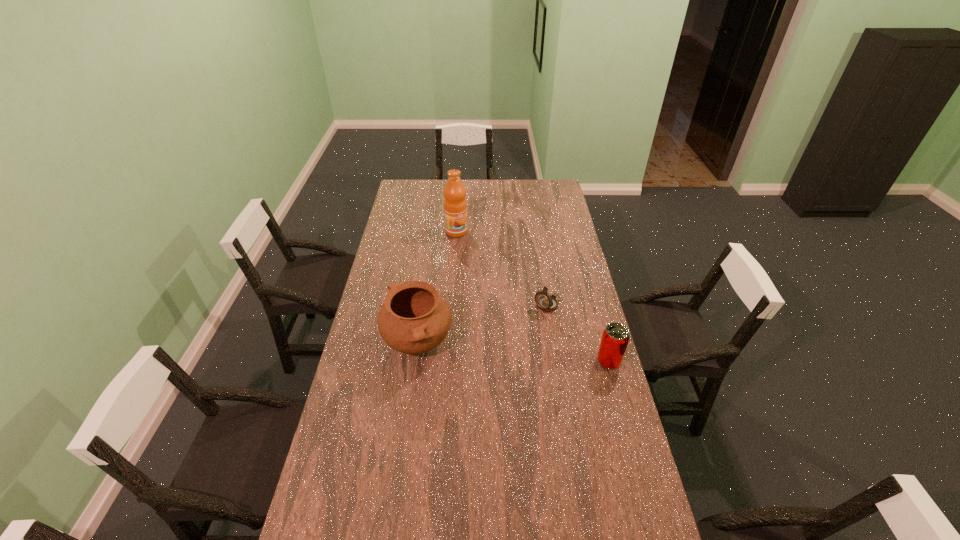
In order to click on pottery in this screenshot , I will do click(414, 318).

Where is `soda can`? soda can is located at coordinates (615, 338).

I want to click on the rightmost object, so click(615, 338).

Find the location of a particular element. fruit juice is located at coordinates (455, 206).

The image size is (960, 540). What are the coordinates of `the tallest object` in the screenshot? It's located at (455, 206).

At what (x,y) coordinates should I click in order to perform the action: click on the shortest object. Please return your answer as a coordinate pair (x, y). This screenshot has height=540, width=960. Looking at the image, I should click on [546, 302].

Locate an element on the screen. This screenshot has height=540, width=960. the third object from left to right is located at coordinates (546, 302).

At what (x,y) coordinates should I click in order to perform the action: click on blank area located on the right of the pottery. Please return your answer as a coordinate pair (x, y). The image size is (960, 540). Looking at the image, I should click on (519, 343).

Locate an element on the screen. vacant space located on the front of the soda can is located at coordinates (639, 471).

The width and height of the screenshot is (960, 540). In order to click on free location located 0.050m on the label side of the fruit juice in this screenshot , I will do `click(464, 244)`.